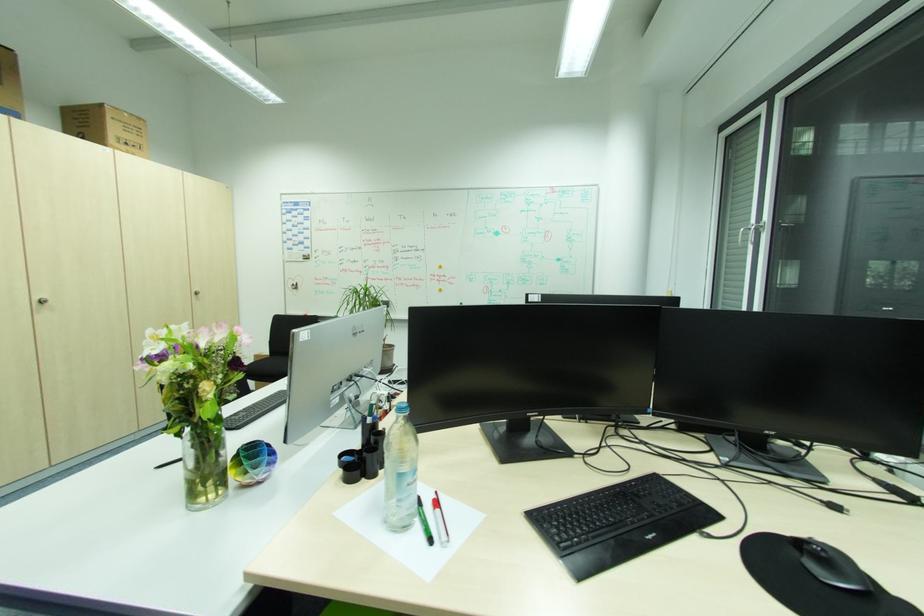
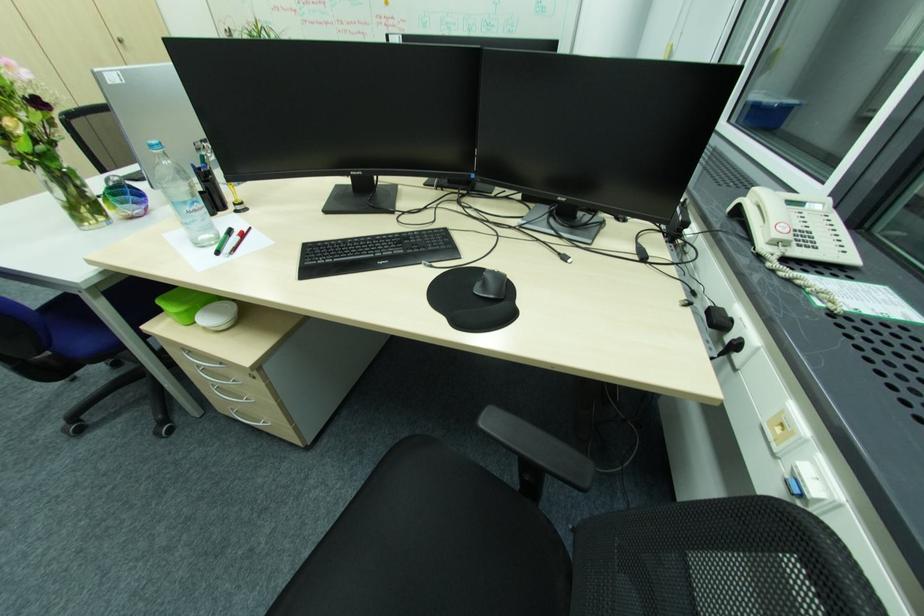
Question: How did the camera likely rotate?

Choices:
 (A) Left
 (B) Right
 (C) Up
 (D) Down

Answer: (D)